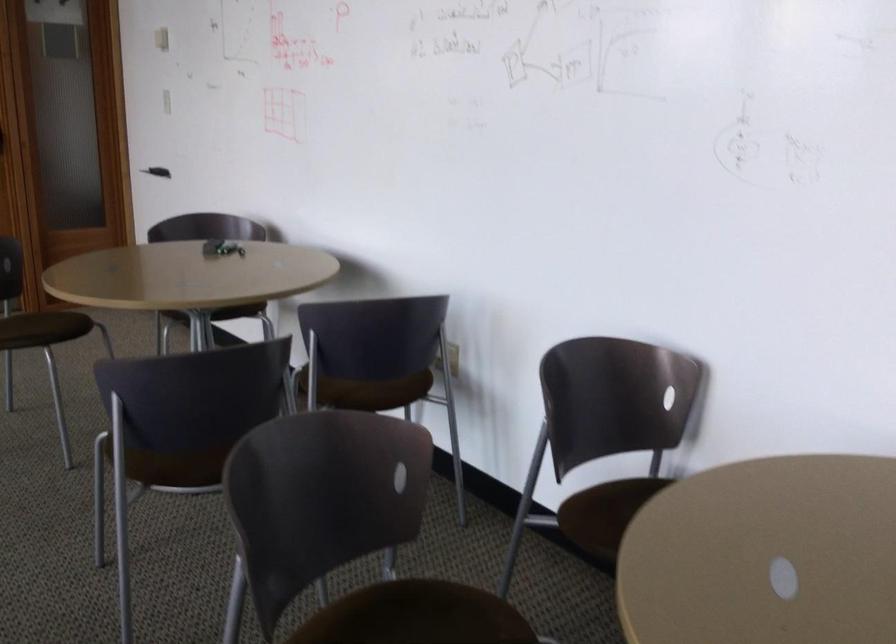
What do you see at coordinates (452, 359) in the screenshot? I see `a white light switch` at bounding box center [452, 359].